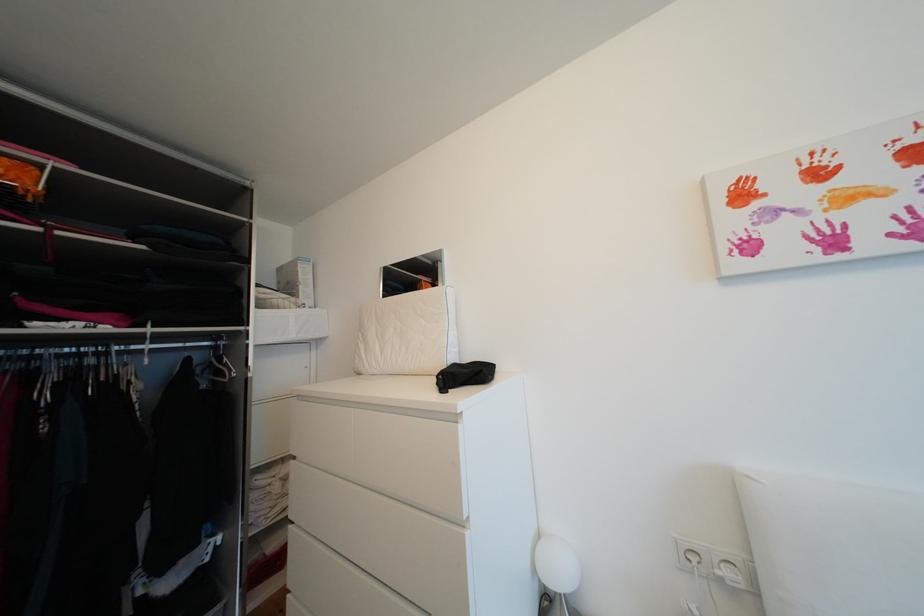
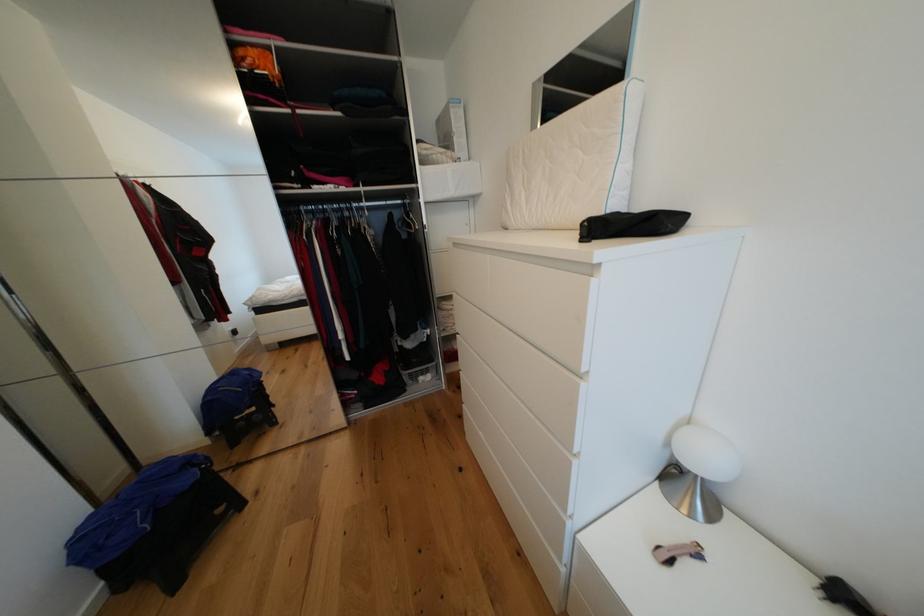
Based on the continuous images, in which direction is the camera rotating?

The rotation direction of the camera is left-down.